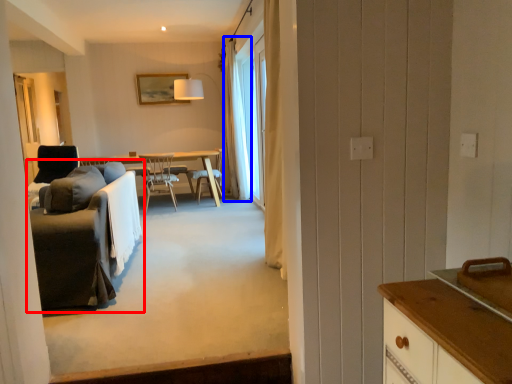
Question: Which object is closer to the camera taking this photo, studio couch (highlighted by a red box) or curtain (highlighted by a blue box)?

Choices:
 (A) studio couch
 (B) curtain

Answer: (A)